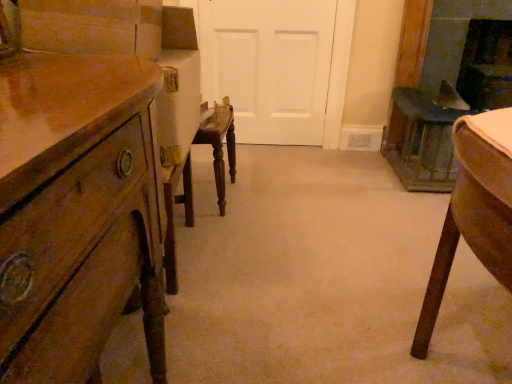
What do you see at coordinates (77, 213) in the screenshot? I see `wooden chest of drawers at left` at bounding box center [77, 213].

The image size is (512, 384). In order to click on wooden chest of drawers at left in this screenshot , I will do `click(77, 213)`.

Consider the image. Which of these two, dark brown wood fireplace at upper right, the first fireplace in the right-to-left sequence, or wooden chest of drawers at left, is wider?

With larger width is dark brown wood fireplace at upper right, the first fireplace in the right-to-left sequence.

Between dark brown wood fireplace at upper right, the first fireplace in the right-to-left sequence, and wooden chest of drawers at left, which one appears on the right side from the viewer's perspective?

dark brown wood fireplace at upper right, the first fireplace in the right-to-left sequence, is more to the right.

At what (x,y) coordinates should I click in order to perform the action: click on fireplace that is the 2nd one above the wooden chest of drawers at left (from a real-world perspective). Please return your answer as a coordinate pair (x, y). This screenshot has height=384, width=512. Looking at the image, I should click on (454, 36).

From the image's perspective, is dark brown wood fireplace at upper right, the 2th fireplace viewed from the left, located above wooden chest of drawers at left?

Yes, from the image's perspective, dark brown wood fireplace at upper right, the 2th fireplace viewed from the left, is above wooden chest of drawers at left.

Considering the relative sizes of wooden chest of drawers at left and dark gray stone fireplace at right, marked as the 2th fireplace in a right-to-left arrangement, in the image provided, is wooden chest of drawers at left shorter than dark gray stone fireplace at right, marked as the 2th fireplace in a right-to-left arrangement,?

Yes.

In terms of width, does wooden chest of drawers at left look wider or thinner when compared to dark gray stone fireplace at right, marked as the 2th fireplace in a right-to-left arrangement?

Clearly, wooden chest of drawers at left has more width compared to dark gray stone fireplace at right, marked as the 2th fireplace in a right-to-left arrangement.

Is dark gray stone fireplace at right, marked as the 2th fireplace in a right-to-left arrangement, located within wooden chest of drawers at left?

No, dark gray stone fireplace at right, marked as the 2th fireplace in a right-to-left arrangement, is not inside wooden chest of drawers at left.

Is wooden chest of drawers at left to the left of dark gray stone fireplace at right, the first fireplace from the left, from the viewer's perspective?

Yes, wooden chest of drawers at left is to the left of dark gray stone fireplace at right, the first fireplace from the left.

Can you confirm if white matte door at center is positioned to the left of wooden chest of drawers at left?

Incorrect, white matte door at center is not on the left side of wooden chest of drawers at left.

Consider the image. From the image's perspective, does white matte door at center appear lower than wooden chest of drawers at left?

No.

Would you say white matte door at center is outside wooden chest of drawers at left?

Yes, white matte door at center is not within wooden chest of drawers at left.

Consider the image. From the image's perspective, which one is positioned lower, dark gray stone fireplace at right, marked as the 2th fireplace in a right-to-left arrangement, or dark brown wood fireplace at upper right, the first fireplace in the right-to-left sequence?

dark gray stone fireplace at right, marked as the 2th fireplace in a right-to-left arrangement, from the image's perspective.

Is dark gray stone fireplace at right, the first fireplace from the left, at the left side of dark brown wood fireplace at upper right, the first fireplace in the right-to-left sequence?

Correct, you'll find dark gray stone fireplace at right, the first fireplace from the left, to the left of dark brown wood fireplace at upper right, the first fireplace in the right-to-left sequence.

Is dark gray stone fireplace at right, the first fireplace from the left, in contact with dark brown wood fireplace at upper right, the first fireplace in the right-to-left sequence?

No, dark gray stone fireplace at right, the first fireplace from the left, is not next to dark brown wood fireplace at upper right, the first fireplace in the right-to-left sequence.

Is dark gray stone fireplace at right, marked as the 2th fireplace in a right-to-left arrangement, outside of dark brown wood fireplace at upper right, the first fireplace in the right-to-left sequence?

dark gray stone fireplace at right, marked as the 2th fireplace in a right-to-left arrangement, is positioned outside dark brown wood fireplace at upper right, the first fireplace in the right-to-left sequence.

From a real-world perspective, is wooden chest of drawers at left beneath dark brown wood fireplace at upper right, the first fireplace in the right-to-left sequence?

Yes.

From the picture: Is wooden chest of drawers at left spatially inside dark brown wood fireplace at upper right, the 2th fireplace viewed from the left, or outside of it?

wooden chest of drawers at left exists outside the volume of dark brown wood fireplace at upper right, the 2th fireplace viewed from the left.

This screenshot has width=512, height=384. Identify the location of chest of drawers below the dark brown wood fireplace at upper right, the first fireplace in the right-to-left sequence (from a real-world perspective). (77, 213).

Is white matte door at center far from dark gray stone fireplace at right, the first fireplace from the left?

No.

Could you tell me if white matte door at center is facing dark gray stone fireplace at right, the first fireplace from the left?

No, white matte door at center is not turned towards dark gray stone fireplace at right, the first fireplace from the left.

Which object is positioned more to the right, white matte door at center or dark gray stone fireplace at right, marked as the 2th fireplace in a right-to-left arrangement?

Positioned to the right is dark gray stone fireplace at right, marked as the 2th fireplace in a right-to-left arrangement.

From a real-world perspective, is white matte door at center physically above dark gray stone fireplace at right, marked as the 2th fireplace in a right-to-left arrangement?

Yes, from a real-world perspective, white matte door at center is on top of dark gray stone fireplace at right, marked as the 2th fireplace in a right-to-left arrangement.

Consider the image. Considering the relative sizes of dark brown wood fireplace at upper right, the first fireplace in the right-to-left sequence, and dark gray stone fireplace at right, marked as the 2th fireplace in a right-to-left arrangement, in the image provided, is dark brown wood fireplace at upper right, the first fireplace in the right-to-left sequence, thinner than dark gray stone fireplace at right, marked as the 2th fireplace in a right-to-left arrangement,?

Incorrect, the width of dark brown wood fireplace at upper right, the first fireplace in the right-to-left sequence, is not less than that of dark gray stone fireplace at right, marked as the 2th fireplace in a right-to-left arrangement.

Is there a large distance between dark brown wood fireplace at upper right, the first fireplace in the right-to-left sequence, and dark gray stone fireplace at right, the first fireplace from the left?

Actually, dark brown wood fireplace at upper right, the first fireplace in the right-to-left sequence, and dark gray stone fireplace at right, the first fireplace from the left, are a little close together.

From the image's perspective, is dark brown wood fireplace at upper right, the 2th fireplace viewed from the left, below dark gray stone fireplace at right, the first fireplace from the left?

Incorrect, from the image's perspective, dark brown wood fireplace at upper right, the 2th fireplace viewed from the left, is higher than dark gray stone fireplace at right, the first fireplace from the left.

Where is `the chest of drawers that is under the dark brown wood fireplace at upper right, the first fireplace in the right-to-left sequence (from a real-world perspective)`? the chest of drawers that is under the dark brown wood fireplace at upper right, the first fireplace in the right-to-left sequence (from a real-world perspective) is located at coordinates (77, 213).

Where is `chest of drawers lying on the left of dark gray stone fireplace at right, the first fireplace from the left`? This screenshot has width=512, height=384. chest of drawers lying on the left of dark gray stone fireplace at right, the first fireplace from the left is located at coordinates (77, 213).

Which object lies nearer to the anchor point dark brown wood fireplace at upper right, the first fireplace in the right-to-left sequence, wooden chest of drawers at left or white matte door at center?

Among the two, white matte door at center is located nearer to dark brown wood fireplace at upper right, the first fireplace in the right-to-left sequence.

From the image, which object appears to be farther from dark brown wood fireplace at upper right, the 2th fireplace viewed from the left, wooden chest of drawers at left or dark gray stone fireplace at right, marked as the 2th fireplace in a right-to-left arrangement?

wooden chest of drawers at left.

When comparing their distances from white matte door at center, does dark gray stone fireplace at right, marked as the 2th fireplace in a right-to-left arrangement, or dark brown wood fireplace at upper right, the 2th fireplace viewed from the left, seem closer?

dark gray stone fireplace at right, marked as the 2th fireplace in a right-to-left arrangement, is closer to white matte door at center.

Looking at this image, based on their spatial positions, is wooden chest of drawers at left or white matte door at center closer to dark gray stone fireplace at right, marked as the 2th fireplace in a right-to-left arrangement?

white matte door at center.

From the image, which object appears to be farther from wooden chest of drawers at left, dark brown wood fireplace at upper right, the 2th fireplace viewed from the left, or dark gray stone fireplace at right, marked as the 2th fireplace in a right-to-left arrangement?

dark brown wood fireplace at upper right, the 2th fireplace viewed from the left, lies further to wooden chest of drawers at left than the other object.

From the image, which object appears to be nearer to dark gray stone fireplace at right, the first fireplace from the left, white matte door at center or wooden chest of drawers at left?

white matte door at center is positioned closer to the anchor dark gray stone fireplace at right, the first fireplace from the left.

Looking at the image, which one is located closer to dark gray stone fireplace at right, the first fireplace from the left, white matte door at center or dark brown wood fireplace at upper right, the first fireplace in the right-to-left sequence?

dark brown wood fireplace at upper right, the first fireplace in the right-to-left sequence, lies closer to dark gray stone fireplace at right, the first fireplace from the left, than the other object.

Based on their spatial positions, is dark gray stone fireplace at right, the first fireplace from the left, or white matte door at center closer to wooden chest of drawers at left?

Among the two, white matte door at center is located nearer to wooden chest of drawers at left.

At what (x,y) coordinates should I click in order to perform the action: click on fireplace situated between white matte door at center and dark brown wood fireplace at upper right, the 2th fireplace viewed from the left, from left to right. Please return your answer as a coordinate pair (x, y). Looking at the image, I should click on (447, 81).

Where is `fireplace between wooden chest of drawers at left and dark brown wood fireplace at upper right, the 2th fireplace viewed from the left, in the front-back direction`? This screenshot has width=512, height=384. fireplace between wooden chest of drawers at left and dark brown wood fireplace at upper right, the 2th fireplace viewed from the left, in the front-back direction is located at coordinates (447, 81).